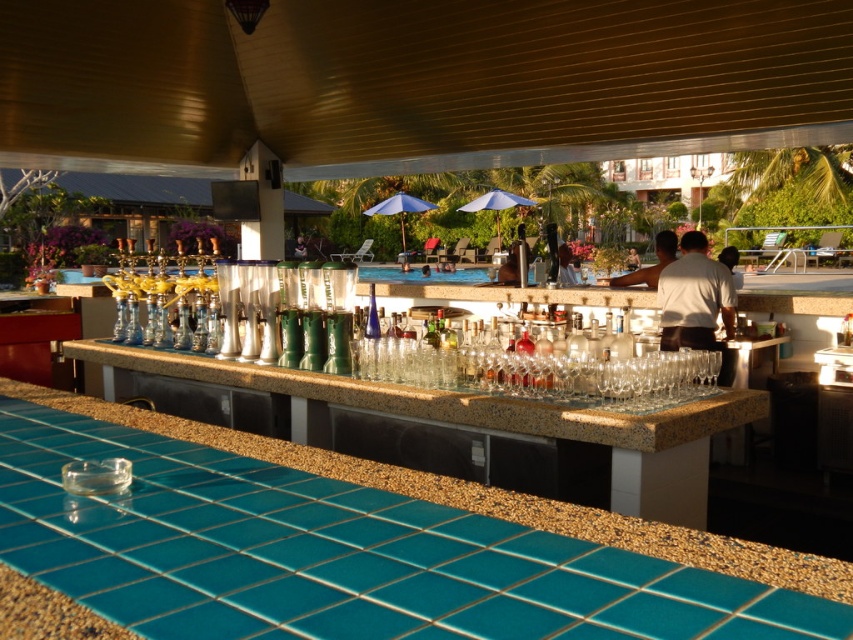
Question: Is teal tile countertop at lower left wider than white shirt at upper center?

Choices:
 (A) yes
 (B) no

Answer: (A)

Question: Is white matte shirt at center thinner than white shirt at upper center?

Choices:
 (A) no
 (B) yes

Answer: (B)

Question: Among these objects, which one is farthest from the camera?

Choices:
 (A) teal tile countertop at lower left
 (B) white matte shirt at center

Answer: (B)

Question: Which object is positioned closest to the teal tile countertop at lower left?

Choices:
 (A) white shirt at upper center
 (B) white matte shirt at center

Answer: (B)

Question: Which of the following is the farthest from the observer?

Choices:
 (A) (679, 273)
 (B) (314, 451)
 (C) (656, 278)

Answer: (C)

Question: Does teal tile countertop at lower left come behind white shirt at upper center?

Choices:
 (A) no
 (B) yes

Answer: (A)